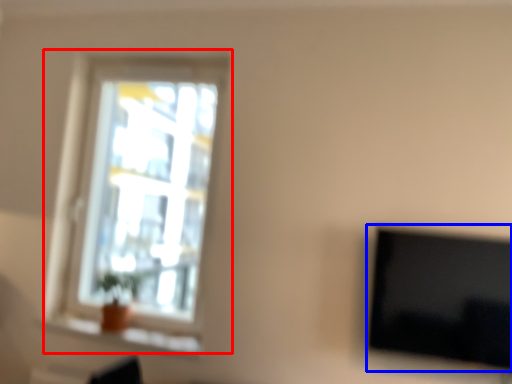
Question: Among these objects, which one is farthest to the camera, window (highlighted by a red box) or television (highlighted by a blue box)?

Choices:
 (A) window
 (B) television

Answer: (A)